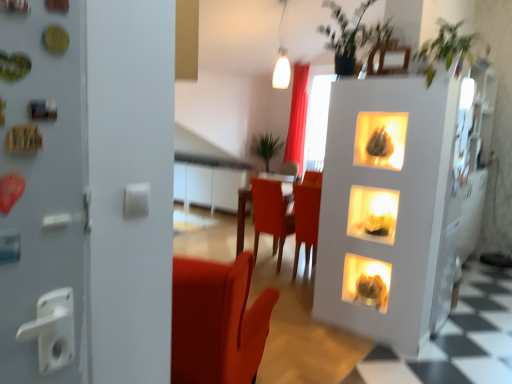
Measure the distance between matte brown fireplace at lower right, marked as the second fireplace in a top-to-bottom arrangement, and camera.

The depth of matte brown fireplace at lower right, marked as the second fireplace in a top-to-bottom arrangement, is 9.82 feet.

You are a GUI agent. You are given a task and a screenshot of the screen. Output one action in this format:
    pyautogui.click(x=<x>, y=<y>)
    Task: Click on the green leafy plant at upper right, the first plant viewed from the right
    The width and height of the screenshot is (512, 384).
    Given the screenshot: What is the action you would take?
    pyautogui.click(x=448, y=48)

In order to click on green leafy plant at upper center, which is counted as the second plant, starting from the back in this screenshot , I will do `click(349, 36)`.

Based on the photo, how much space does matte yellow stone at center, which is the 1th fireplace in top-to-bottom order, occupy vertically?

matte yellow stone at center, which is the 1th fireplace in top-to-bottom order, is 9.98 inches in height.

Measure the distance between wooden table at center and camera.

wooden table at center and camera are 14.70 feet apart from each other.

Locate an element on the screen. red velvet curtain at upper center is located at coordinates (297, 117).

Which is further, (385, 228) or (290, 112)?

The point (290, 112) is farther.

Which of these two, matte yellow stone at center, arranged as the second fireplace when ordered from the bottom, or red velvet curtain at upper center, stands taller?

red velvet curtain at upper center.

Is matte yellow stone at center, arranged as the second fireplace when ordered from the bottom, directly adjacent to red velvet curtain at upper center?

No, matte yellow stone at center, arranged as the second fireplace when ordered from the bottom, is not touching red velvet curtain at upper center.

From the image's perspective, is matte yellow stone at center, which is the 1th fireplace in top-to-bottom order, located above or below red velvet curtain at upper center?

Clearly, from the image's perspective, matte yellow stone at center, which is the 1th fireplace in top-to-bottom order, is below red velvet curtain at upper center.

Considering the positions of objects red velvet curtain at upper center and matte yellow stone at center, arranged as the second fireplace when ordered from the bottom, in the image provided, who is more to the left, red velvet curtain at upper center or matte yellow stone at center, arranged as the second fireplace when ordered from the bottom,?

red velvet curtain at upper center is more to the left.

Does red velvet curtain at upper center have a lesser height compared to matte yellow stone at center, arranged as the second fireplace when ordered from the bottom?

In fact, red velvet curtain at upper center may be taller than matte yellow stone at center, arranged as the second fireplace when ordered from the bottom.

Between red velvet curtain at upper center and matte yellow stone at center, which is the 1th fireplace in top-to-bottom order, which one has larger width?

With larger width is red velvet curtain at upper center.

From a real-world perspective, between red velvet curtain at upper center and matte yellow stone at center, arranged as the second fireplace when ordered from the bottom, who is vertically higher?

In real-world perspective, red velvet curtain at upper center is above.

Looking at this image, from a real-world perspective, is green leafy plant at upper center, marked as the second plant in a left-to-right arrangement, located higher than matte brown fireplace at lower right, which appears as the first fireplace when ordered from the bottom?

Yes, from a real-world perspective, green leafy plant at upper center, marked as the second plant in a left-to-right arrangement, is on top of matte brown fireplace at lower right, which appears as the first fireplace when ordered from the bottom.

Considering the points (331, 16) and (362, 272), which point is in front, point (331, 16) or point (362, 272)?

The point (362, 272) is more forward.

Can you tell me how much green leafy plant at center, which is the 3th plant in front-to-back order, and wooden table at center differ in facing direction?

They differ by 180 degrees in their facing directions.

Is green leafy plant at center, acting as the first plant starting from the back, far from wooden table at center?

Yes, green leafy plant at center, acting as the first plant starting from the back, and wooden table at center are quite far apart.

Is green leafy plant at center, acting as the first plant starting from the back, inside or outside of wooden table at center?

green leafy plant at center, acting as the first plant starting from the back, is spatially situated outside wooden table at center.

Who is bigger, green leafy plant at center, marked as the first plant in a left-to-right arrangement, or wooden table at center?

Bigger between the two is wooden table at center.

Which is behind, point (365, 232) or point (476, 40)?

Point (476, 40)

Does matte yellow stone at center, arranged as the second fireplace when ordered from the bottom, turn towards green leafy plant at upper right, which is the first plant in front-to-back order?

No, matte yellow stone at center, arranged as the second fireplace when ordered from the bottom, is not aimed at green leafy plant at upper right, which is the first plant in front-to-back order.

From the image's perspective, count 1st fireplaces downward from the green leafy plant at upper right, which is the first plant in front-to-back order, and point to it. Please provide its 2D coordinates.

[(373, 214)]

Considering the relative sizes of matte yellow stone at center, arranged as the second fireplace when ordered from the bottom, and green leafy plant at upper right, which is the first plant in front-to-back order, in the image provided, is matte yellow stone at center, arranged as the second fireplace when ordered from the bottom, wider than green leafy plant at upper right, which is the first plant in front-to-back order,?

In fact, matte yellow stone at center, arranged as the second fireplace when ordered from the bottom, might be narrower than green leafy plant at upper right, which is the first plant in front-to-back order.

Is green leafy plant at center, which is the 3th plant in front-to-back order, shorter than green leafy plant at upper center, marked as the second plant in a left-to-right arrangement?

Incorrect, the height of green leafy plant at center, which is the 3th plant in front-to-back order, does not fall short of that of green leafy plant at upper center, marked as the second plant in a left-to-right arrangement.

Is green leafy plant at center, marked as the first plant in a left-to-right arrangement, wider than green leafy plant at upper center, which is counted as the second plant, starting from the back?

Yes.

Does green leafy plant at center, marked as the 3th plant in a right-to-left arrangement, have a larger size compared to green leafy plant at upper center, which appears as the second plant when viewed from the right?

Correct, green leafy plant at center, marked as the 3th plant in a right-to-left arrangement, is larger in size than green leafy plant at upper center, which appears as the second plant when viewed from the right.

Would you say green leafy plant at center, marked as the first plant in a left-to-right arrangement, contains green leafy plant at upper center, which is counted as the second plant, starting from the back?

No, green leafy plant at upper center, which is counted as the second plant, starting from the back, is not a part of green leafy plant at center, marked as the first plant in a left-to-right arrangement.

I want to click on the 2nd fireplace to the left of the green leafy plant at upper right, which appears as the 3th plant when viewed from the back, starting your count from the anchor, so coord(366,281).

Relative to green leafy plant at upper right, which appears as the 3th plant when viewed from the back, is matte brown fireplace at lower right, which appears as the first fireplace when ordered from the bottom, in front or behind?

In the image, matte brown fireplace at lower right, which appears as the first fireplace when ordered from the bottom, appears behind green leafy plant at upper right, which appears as the 3th plant when viewed from the back.

From a real-world perspective, is matte brown fireplace at lower right, which appears as the first fireplace when ordered from the bottom, located higher than green leafy plant at upper right, which appears as the 3th plant when viewed from the back?

Incorrect, from a real-world perspective, matte brown fireplace at lower right, which appears as the first fireplace when ordered from the bottom, is lower than green leafy plant at upper right, which appears as the 3th plant when viewed from the back.

Considering the sizes of objects matte brown fireplace at lower right, marked as the second fireplace in a top-to-bottom arrangement, and green leafy plant at upper right, the third plant from the left, in the image provided, who is smaller, matte brown fireplace at lower right, marked as the second fireplace in a top-to-bottom arrangement, or green leafy plant at upper right, the third plant from the left,?

matte brown fireplace at lower right, marked as the second fireplace in a top-to-bottom arrangement, is smaller.

This screenshot has height=384, width=512. I want to click on curtain above the matte yellow stone at center, which is the 1th fireplace in top-to-bottom order (from the image's perspective), so click(297, 117).

The height and width of the screenshot is (384, 512). I want to click on fireplace that is the 2nd one when counting rightward from the red velvet curtain at upper center, so click(x=373, y=214).

From the image, which object appears to be nearer to green leafy plant at center, marked as the first plant in a left-to-right arrangement, red velvet curtain at upper center or wooden table at center?

red velvet curtain at upper center.

Based on their spatial positions, is green leafy plant at upper right, which appears as the 3th plant when viewed from the back, or matte yellow stone at center, arranged as the second fireplace when ordered from the bottom, closer to matte brown fireplace at lower right, which appears as the first fireplace when ordered from the bottom?

matte yellow stone at center, arranged as the second fireplace when ordered from the bottom, is positioned closer to the anchor matte brown fireplace at lower right, which appears as the first fireplace when ordered from the bottom.

Looking at the image, which one is located further to matte yellow stone at center, which is the 1th fireplace in top-to-bottom order, green leafy plant at upper center, which appears as the second plant when viewed from the right, or red velvet curtain at upper center?

The object further to matte yellow stone at center, which is the 1th fireplace in top-to-bottom order, is red velvet curtain at upper center.

Looking at the image, which one is located further to green leafy plant at upper right, which is the first plant in front-to-back order, green leafy plant at center, acting as the first plant starting from the back, or matte brown fireplace at lower right, marked as the second fireplace in a top-to-bottom arrangement?

green leafy plant at center, acting as the first plant starting from the back.

Looking at this image, considering their positions, is wooden table at center positioned closer to matte brown fireplace at lower right, marked as the second fireplace in a top-to-bottom arrangement, than green leafy plant at upper right, which appears as the 3th plant when viewed from the back?

Among the two, green leafy plant at upper right, which appears as the 3th plant when viewed from the back, is located nearer to matte brown fireplace at lower right, marked as the second fireplace in a top-to-bottom arrangement.

Looking at the image, which one is located further to red velvet curtain at upper center, green leafy plant at upper center, which ranks as the 2th plant in front-to-back order, or matte yellow stone at center, which is the 1th fireplace in top-to-bottom order?

The object further to red velvet curtain at upper center is matte yellow stone at center, which is the 1th fireplace in top-to-bottom order.

Based on their spatial positions, is matte yellow stone at center, arranged as the second fireplace when ordered from the bottom, or red velvet curtain at upper center closer to green leafy plant at center, which is the 3th plant in front-to-back order?

Based on the image, red velvet curtain at upper center appears to be nearer to green leafy plant at center, which is the 3th plant in front-to-back order.

Looking at the image, which one is located closer to green leafy plant at center, marked as the 3th plant in a right-to-left arrangement, wooden table at center or red velvet curtain at upper center?

The object closer to green leafy plant at center, marked as the 3th plant in a right-to-left arrangement, is red velvet curtain at upper center.

Identify the location of plant positioned between matte yellow stone at center, arranged as the second fireplace when ordered from the bottom, and red velvet curtain at upper center from near to far. The image size is (512, 384). (265, 147).

Where is `fireplace between green leafy plant at upper right, which is the first plant in front-to-back order, and matte brown fireplace at lower right, which appears as the first fireplace when ordered from the bottom, vertically`? fireplace between green leafy plant at upper right, which is the first plant in front-to-back order, and matte brown fireplace at lower right, which appears as the first fireplace when ordered from the bottom, vertically is located at coordinates point(373,214).

At what (x,y) coordinates should I click in order to perform the action: click on fireplace located between matte yellow stone at center, which is the 1th fireplace in top-to-bottom order, and green leafy plant at center, which is the 3th plant in front-to-back order, in the depth direction. Please return your answer as a coordinate pair (x, y). This screenshot has width=512, height=384. Looking at the image, I should click on (366, 281).

This screenshot has width=512, height=384. I want to click on plant located between green leafy plant at upper center, marked as the second plant in a left-to-right arrangement, and red velvet curtain at upper center in the depth direction, so click(265, 147).